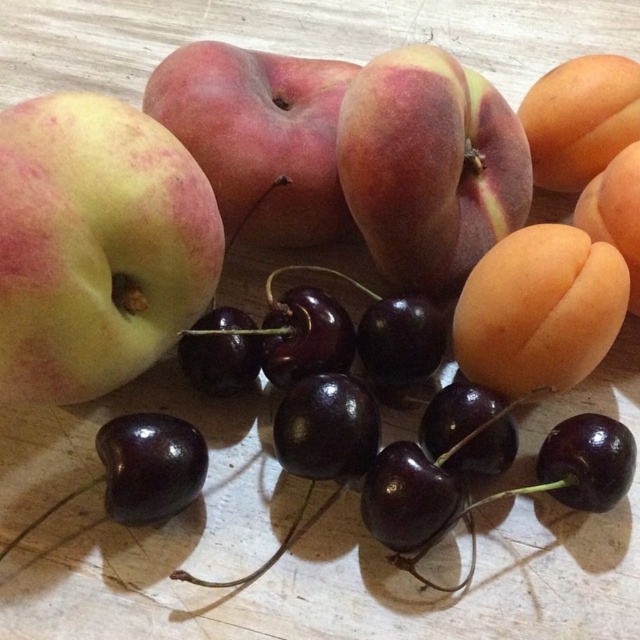
You are arranging fruits on a wooden table and see the matte yellow apple at center and the matte peach at center. Which fruit is located above the other?

The matte peach at center is above the matte yellow apple at center because the apple is positioned under the peach.

You are standing at the origin point in the image. A matte yellow apple at center is located at point (97, 244). If you move 0.1 units to the right, will you be closer to or farther from the matte yellow apple at center?

Moving 0.1 units to the right from the origin point would take you to a position at 0.1, 0.0. The distance between this new position and the matte yellow apple at center at (97, 244) can be calculated using the distance formula. The original distance from the origin to the apple is sqrt0.384 squared plus 0.152 squared. After moving right, the new distance is sqrt0.284 squared plus 0.152 squared. Since 0.284 is less than 0.384, the new distance is shorter. Therefore, you would be closer to the matte yello